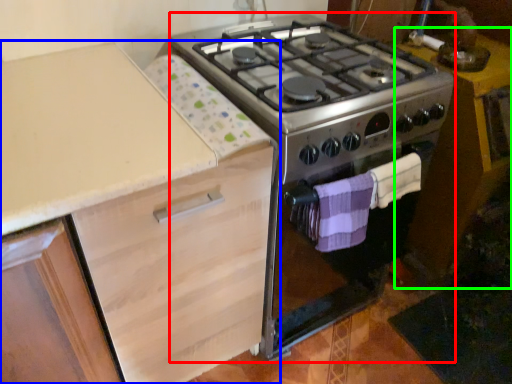
Question: Considering the real-world distances, which object is closest to appliance (highlighted by a red box)? cabinetry (highlighted by a blue box) or table (highlighted by a green box).

Choices:
 (A) cabinetry
 (B) table

Answer: (A)